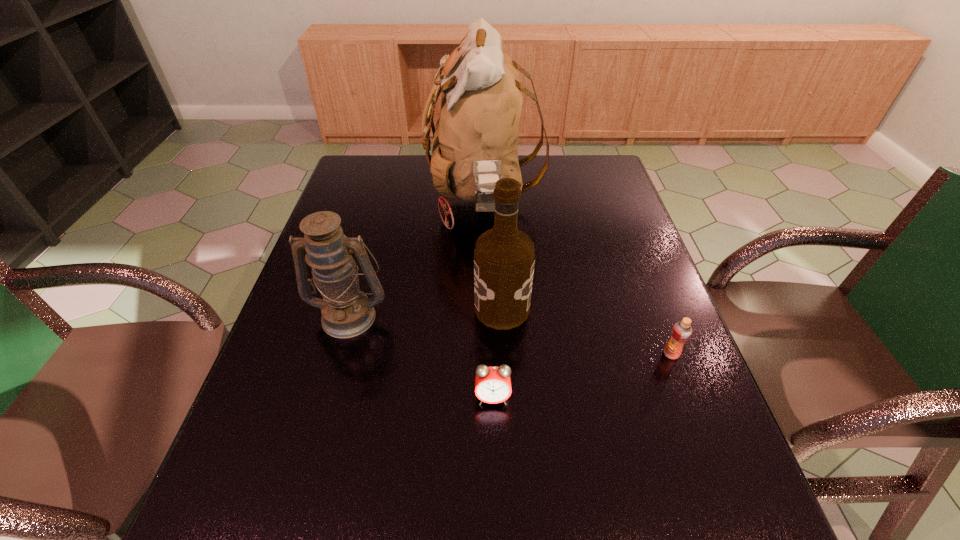
You are a GUI agent. You are given a task and a screenshot of the screen. Output one action in this format:
    pyautogui.click(x=<x>, y=<y>)
    Task: Click on the object at the right edge
    The width and height of the screenshot is (960, 540).
    Given the screenshot: What is the action you would take?
    pyautogui.click(x=681, y=332)

I want to click on vacant space at the far edge of the desktop, so click(563, 180).

Find the location of a particular element. The height and width of the screenshot is (540, 960). vacant space at the left edge of the desktop is located at coordinates (282, 353).

Locate an element on the screen. This screenshot has height=540, width=960. vacant space at the right edge is located at coordinates (644, 244).

Where is `free space at the far left corner of the desktop`? free space at the far left corner of the desktop is located at coordinates (365, 172).

Locate an element on the screen. The image size is (960, 540). vacant space at the near right corner is located at coordinates click(x=671, y=519).

You are a GUI agent. You are given a task and a screenshot of the screen. Output one action in this format:
    pyautogui.click(x=<x>, y=<y>)
    Task: Click on the vacant point located between the rightmost object and the shortest object
    
    Given the screenshot: What is the action you would take?
    pyautogui.click(x=582, y=376)

Where is `vacant area that lies between the oil lamp and the fourth farthest object`? Image resolution: width=960 pixels, height=540 pixels. vacant area that lies between the oil lamp and the fourth farthest object is located at coordinates (511, 335).

This screenshot has height=540, width=960. In order to click on vacant area that lies between the alcohol and the third tallest object in this screenshot , I will do `click(425, 312)`.

This screenshot has width=960, height=540. Identify the location of free spot between the second nearest object and the leftmost object. (511, 335).